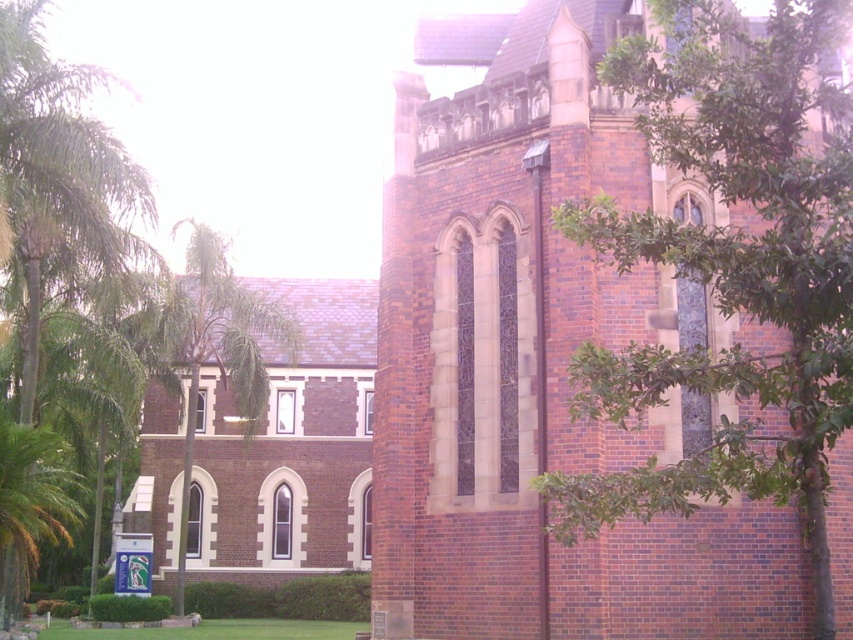
Question: Does green leafy tree at right have a larger size compared to green leafy tree at left?

Choices:
 (A) yes
 (B) no

Answer: (B)

Question: Which of the following is the closest to the observer?

Choices:
 (A) (223, 250)
 (B) (56, 476)
 (C) (630, 259)

Answer: (C)

Question: Which object appears closest to the camera in this image?

Choices:
 (A) green leafy tree at left
 (B) green leafy tree at right
 (C) green leafy tree at center

Answer: (B)

Question: Does green leafy tree at right have a greater width compared to green leafy tree at left?

Choices:
 (A) no
 (B) yes

Answer: (A)

Question: Considering the real-world distances, which object is farthest from the green leafy palm at lower left?

Choices:
 (A) green leafy tree at left
 (B) green leafy tree at center

Answer: (B)

Question: Is green leafy tree at right to the right of green leafy tree at left from the viewer's perspective?

Choices:
 (A) yes
 (B) no

Answer: (A)